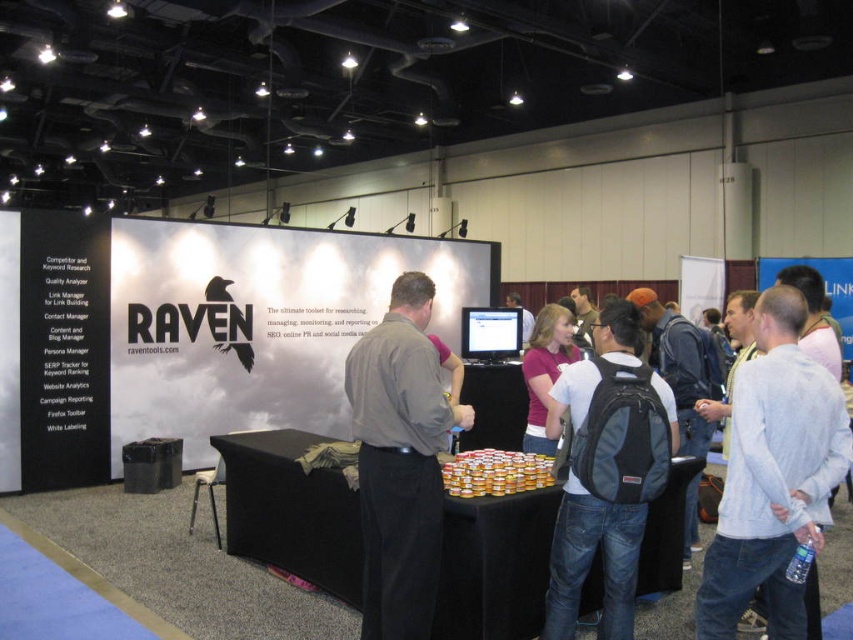
Identify the location of black fabric table at center. This screenshot has height=640, width=853. (291, 509).

Can you confirm if black fabric table at center is thinner than denim jeans at center?

Incorrect, black fabric table at center's width is not less than denim jeans at center's.

Which is behind, point (287, 520) or point (573, 541)?

Point (287, 520)

Where is `black fabric table at center`? This screenshot has width=853, height=640. black fabric table at center is located at coordinates (291, 509).

Who is more distant from viewer, (796, 420) or (566, 356)?

The point (566, 356) is behind.

Between point (817, 534) and point (546, 330), which one is positioned behind?

Point (546, 330)

Where is `gray cotton shirt at right`? Image resolution: width=853 pixels, height=640 pixels. gray cotton shirt at right is located at coordinates (773, 476).

In the scene shown: Can you confirm if gray cotton shirt at right is thinner than denim jeans at center?

No.

Which is above, gray cotton shirt at right or denim jeans at center?

gray cotton shirt at right

The height and width of the screenshot is (640, 853). What do you see at coordinates (773, 476) in the screenshot? I see `gray cotton shirt at right` at bounding box center [773, 476].

Identify the location of gray cotton shirt at right. (773, 476).